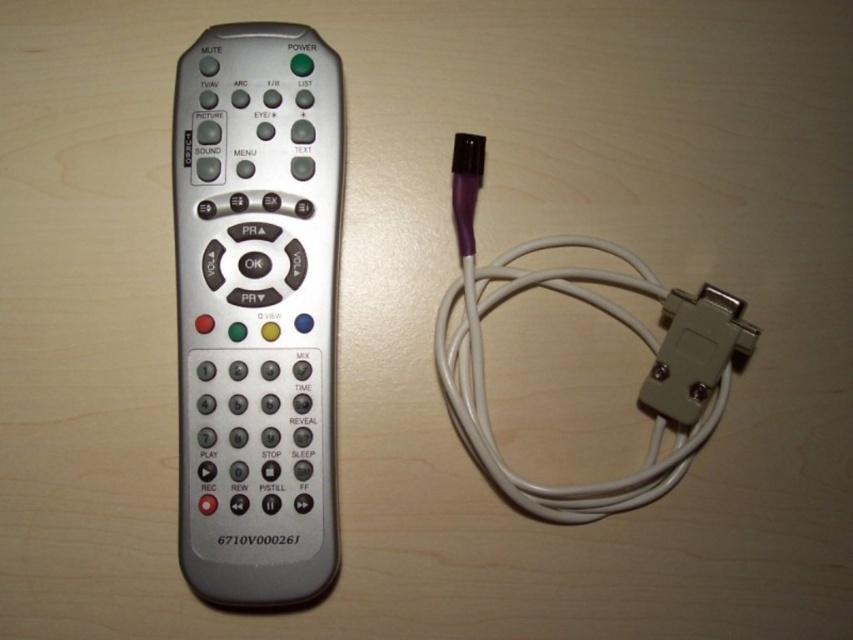
Looking at this image, you need to place both the silver metallic remote at left and the white rubber cable at right into a vertical case that can only accommodate items up to the height of the shorter object. Which object should you use to determine the maximum height limit?

The white rubber cable at right is shorter than the silver metallic remote at left. Therefore, you should use the white rubber cable at right to determine the maximum height limit since it is the shorter object.